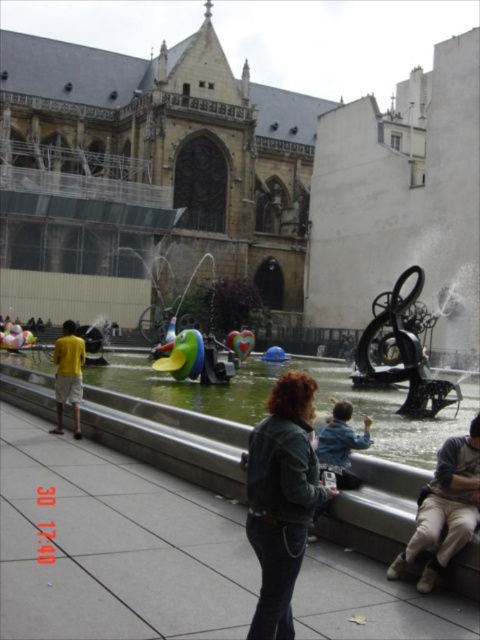
Question: Can you confirm if green rubber duck at center is positioned to the left of denim jacket at lower center?

Choices:
 (A) yes
 (B) no

Answer: (A)

Question: Which of the following is the farthest from the observer?

Choices:
 (A) (420, 520)
 (B) (337, 424)

Answer: (B)

Question: Can you confirm if green rubber duck at center is thinner than khaki cotton pants at lower right?

Choices:
 (A) yes
 (B) no

Answer: (B)

Question: Is denim jacket at lower center wider than yellow cotton shirt at left?

Choices:
 (A) yes
 (B) no

Answer: (B)

Question: Which object is farther from the camera taking this photo?

Choices:
 (A) khaki cotton pants at lower right
 (B) denim jacket at lower center

Answer: (B)

Question: Which point is farther to the camera?

Choices:
 (A) yellow cotton shirt at left
 (B) green rubber duck at center
 (C) denim jacket at lower center
 (D) khaki cotton pants at lower right

Answer: (A)